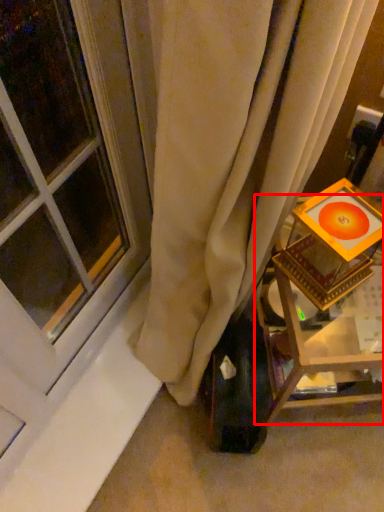
Question: Where is furniture (annotated by the red box) located in relation to window in the image?

Choices:
 (A) right
 (B) left

Answer: (A)